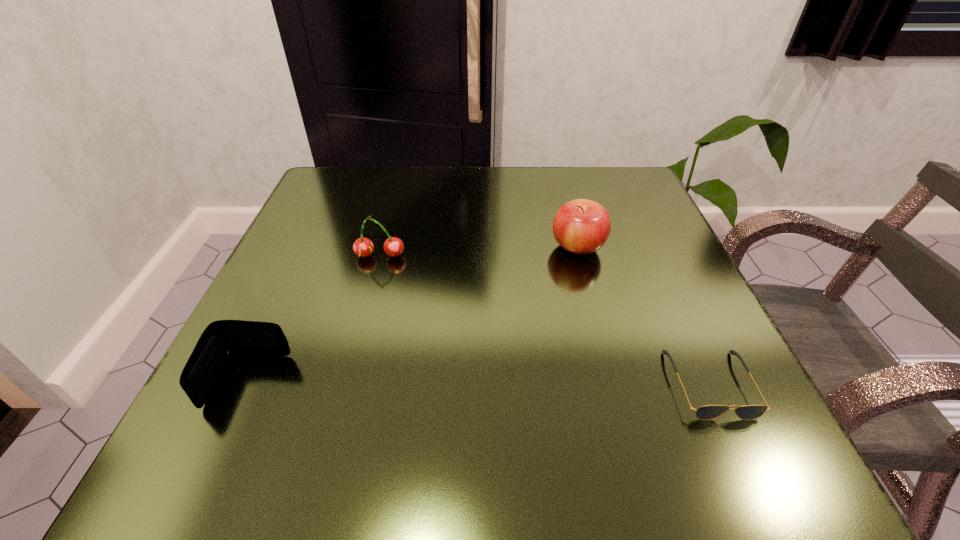
The height and width of the screenshot is (540, 960). Find the location of `apple`. apple is located at coordinates (581, 226).

Where is `the third object from right to left`? the third object from right to left is located at coordinates (363, 247).

Locate an element on the screen. The image size is (960, 540). the leftmost object is located at coordinates (221, 339).

At what (x,y) coordinates should I click in order to perform the action: click on the third tallest object. Please return your answer as a coordinate pair (x, y). The height and width of the screenshot is (540, 960). Looking at the image, I should click on (221, 339).

Where is `sunglasses`? The height and width of the screenshot is (540, 960). sunglasses is located at coordinates click(707, 412).

At what (x,y) coordinates should I click in order to perform the action: click on the shortest object. Please return your answer as a coordinate pair (x, y). The height and width of the screenshot is (540, 960). Looking at the image, I should click on (x=707, y=412).

This screenshot has width=960, height=540. Identify the location of blank space located 0.250m on the left of the apple. (424, 247).

This screenshot has height=540, width=960. Identify the location of free space located 0.310m with stems pointing upwards on the cherry. (340, 407).

In order to click on object that is at the near edge in this screenshot , I will do `click(707, 412)`.

Where is `cherry that is at the left edge`? cherry that is at the left edge is located at coordinates (363, 247).